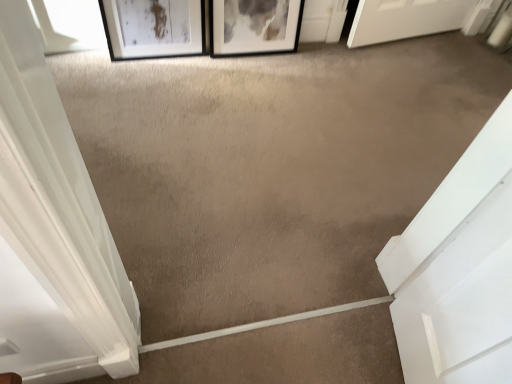
Question: Does transparent glass window at upper left have a greater width compared to black matte picture frame at upper center, the 2th picture frame from the left?

Choices:
 (A) yes
 (B) no

Answer: (B)

Question: Would you say black matte picture frame at upper center, the 2th picture frame from the left, is part of transparent glass window at upper left's contents?

Choices:
 (A) no
 (B) yes

Answer: (A)

Question: Is transparent glass window at upper left positioned beyond the bounds of black matte picture frame at upper center, the first picture frame viewed from the right?

Choices:
 (A) no
 (B) yes

Answer: (B)

Question: Considering the relative sizes of transparent glass window at upper left and black matte picture frame at upper center, the first picture frame viewed from the right, in the image provided, is transparent glass window at upper left thinner than black matte picture frame at upper center, the first picture frame viewed from the right,?

Choices:
 (A) yes
 (B) no

Answer: (A)

Question: Is the surface of transparent glass window at upper left in direct contact with black matte picture frame at upper center, the first picture frame viewed from the right?

Choices:
 (A) yes
 (B) no

Answer: (B)

Question: Considering the positions of matte black picture frame at upper left, which is the first picture frame in left-to-right order, and transparent glass window at upper left in the image, is matte black picture frame at upper left, which is the first picture frame in left-to-right order, wider or thinner than transparent glass window at upper left?

Choices:
 (A) wide
 (B) thin

Answer: (B)

Question: Is matte black picture frame at upper left, acting as the second picture frame starting from the right, taller or shorter than transparent glass window at upper left?

Choices:
 (A) short
 (B) tall

Answer: (B)

Question: Is matte black picture frame at upper left, acting as the second picture frame starting from the right, spatially inside transparent glass window at upper left, or outside of it?

Choices:
 (A) inside
 (B) outside

Answer: (B)

Question: Is point (138, 39) closer or farther from the camera than point (72, 23)?

Choices:
 (A) farther
 (B) closer

Answer: (A)

Question: In terms of width, does matte black picture frame at upper left, acting as the second picture frame starting from the right, look wider or thinner when compared to black matte picture frame at upper center, the 2th picture frame from the left?

Choices:
 (A) wide
 (B) thin

Answer: (B)

Question: In terms of height, does matte black picture frame at upper left, which is the first picture frame in left-to-right order, look taller or shorter compared to black matte picture frame at upper center, the first picture frame viewed from the right?

Choices:
 (A) tall
 (B) short

Answer: (A)

Question: Is point tap(183, 18) closer or farther from the camera than point tap(292, 33)?

Choices:
 (A) farther
 (B) closer

Answer: (B)

Question: Which is correct: matte black picture frame at upper left, acting as the second picture frame starting from the right, is inside black matte picture frame at upper center, the first picture frame viewed from the right, or outside of it?

Choices:
 (A) outside
 (B) inside

Answer: (A)

Question: In the image, is transparent glass window at upper left on the left side or the right side of matte black picture frame at upper left, which is the first picture frame in left-to-right order?

Choices:
 (A) right
 (B) left

Answer: (B)

Question: Considering the positions of transparent glass window at upper left and matte black picture frame at upper left, which is the first picture frame in left-to-right order, in the image, is transparent glass window at upper left taller or shorter than matte black picture frame at upper left, which is the first picture frame in left-to-right order,?

Choices:
 (A) short
 (B) tall

Answer: (A)